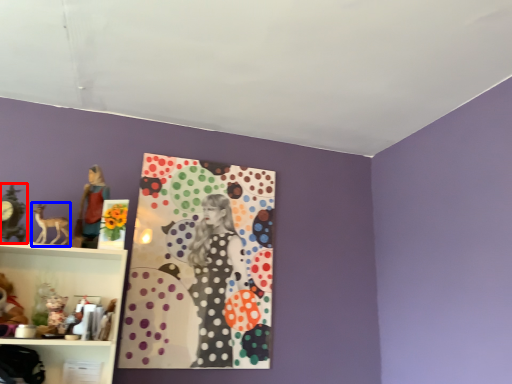
Question: Which object is closer to the camera taking this photo, art (highlighted by a red box) or animal (highlighted by a blue box)?

Choices:
 (A) art
 (B) animal

Answer: (A)